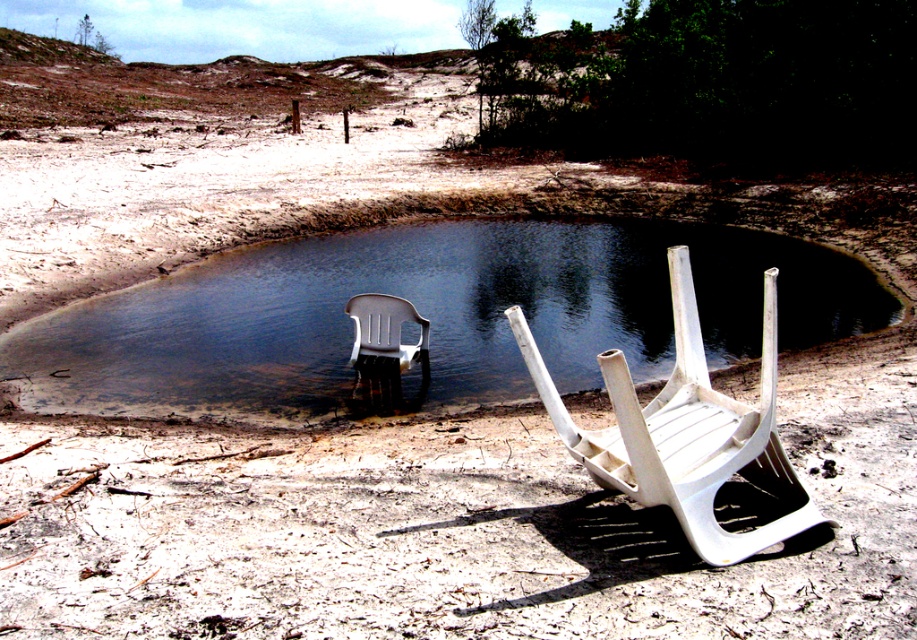
You are standing at the edge of the water and want to walk to the white plastic chair at lower right. Which direction should you move relative to the white matte sand at lower center?

Since the white matte sand at lower center is wider than the white plastic chair at lower right, you should move towards the right side of the white matte sand at lower center to reach the white plastic chair at lower right.